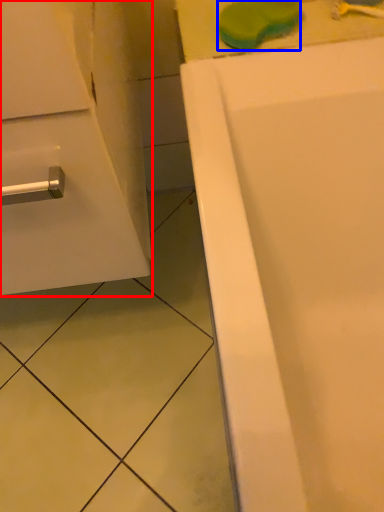
Question: Which object is further to the camera taking this photo, bathroom cabinet (highlighted by a red box) or soap (highlighted by a blue box)?

Choices:
 (A) bathroom cabinet
 (B) soap

Answer: (B)